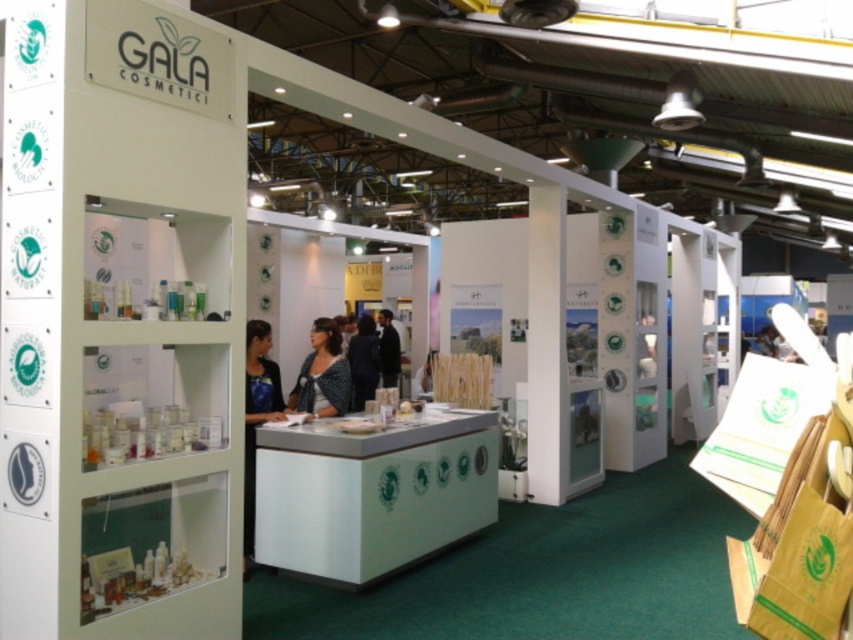
Is point (347, 380) positioned in front of point (350, 358)?

That is True.

Between matte blue blouse at center and black fabric at center, which one appears on the right side from the viewer's perspective?

Positioned to the right is matte blue blouse at center.

The height and width of the screenshot is (640, 853). Describe the element at coordinates (322, 374) in the screenshot. I see `matte blue blouse at center` at that location.

Find the location of a particular element. This screenshot has height=640, width=853. matte blue blouse at center is located at coordinates (322, 374).

Can you confirm if matte black shirt at center is positioned to the right of matte blue blouse at center?

Incorrect, matte black shirt at center is not on the right side of matte blue blouse at center.

Is the position of matte black shirt at center more distant than that of matte blue blouse at center?

No, matte black shirt at center is closer to the viewer.

I want to click on matte black shirt at center, so click(x=257, y=413).

Who is taller, matte black shirt at center or black fabric at center?

matte black shirt at center

From the picture: Can you confirm if matte black shirt at center is thinner than black fabric at center?

Correct, matte black shirt at center's width is less than black fabric at center's.

This screenshot has width=853, height=640. What are the coordinates of `matte black shirt at center` in the screenshot? It's located at (257, 413).